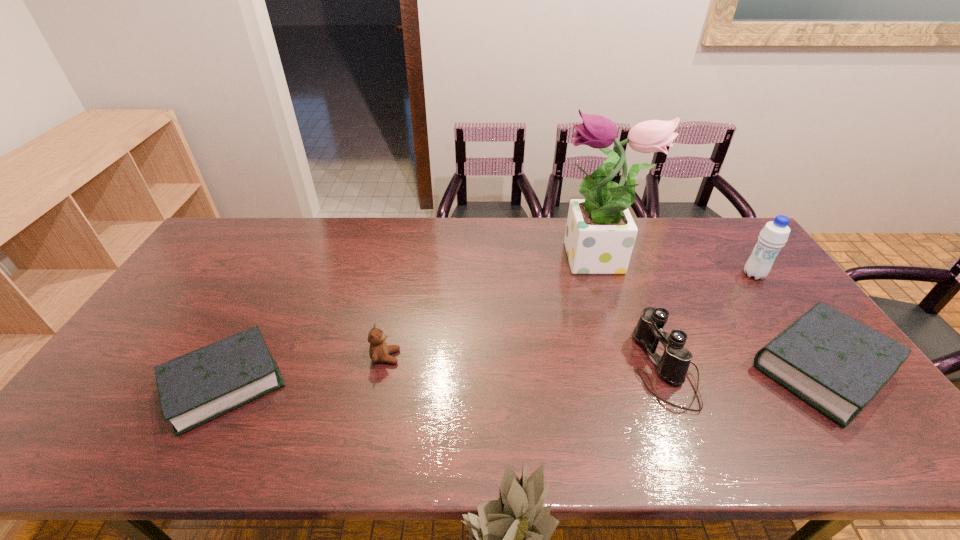
Locate which object ranks fifth in proximity to the binoculars. Please provide its 2D coordinates. Your answer should be formatted as a tuple, i.e. [(x, y)], where the tuple contains the x and y coordinates of a point satisfying the conditions above.

[(199, 386)]

Identify the location of vacant space that satisfies the following two spatial constraints: 1. on the front side of the water bottle; 2. at the face of the second object from left to right. (813, 357).

At what (x,y) coordinates should I click in order to perform the action: click on free region that satisfies the following two spatial constraints: 1. on the front-facing side of the flower arrangement; 2. on the back side of the second shortest object. Please return your answer as a coordinate pair (x, y). Looking at the image, I should click on pos(632,367).

The width and height of the screenshot is (960, 540). Find the location of `vacant position in the image that satisfies the following two spatial constraints: 1. on the back side of the second shortest object; 2. on the right side of the binoculars`. vacant position in the image that satisfies the following two spatial constraints: 1. on the back side of the second shortest object; 2. on the right side of the binoculars is located at coordinates (663, 367).

Image resolution: width=960 pixels, height=540 pixels. I want to click on free space that satisfies the following two spatial constraints: 1. on the front-facing side of the tallest object; 2. on the back side of the second tallest object, so click(x=602, y=275).

Where is `vacant region that satisfies the following two spatial constraints: 1. on the front-facing side of the flower arrangement; 2. on the left side of the taller Bible`? Image resolution: width=960 pixels, height=540 pixels. vacant region that satisfies the following two spatial constraints: 1. on the front-facing side of the flower arrangement; 2. on the left side of the taller Bible is located at coordinates (632, 367).

In order to click on vacant region that satisfies the following two spatial constraints: 1. at the face of the fourth tallest object; 2. on the left side of the right Bible in this screenshot , I will do `click(384, 367)`.